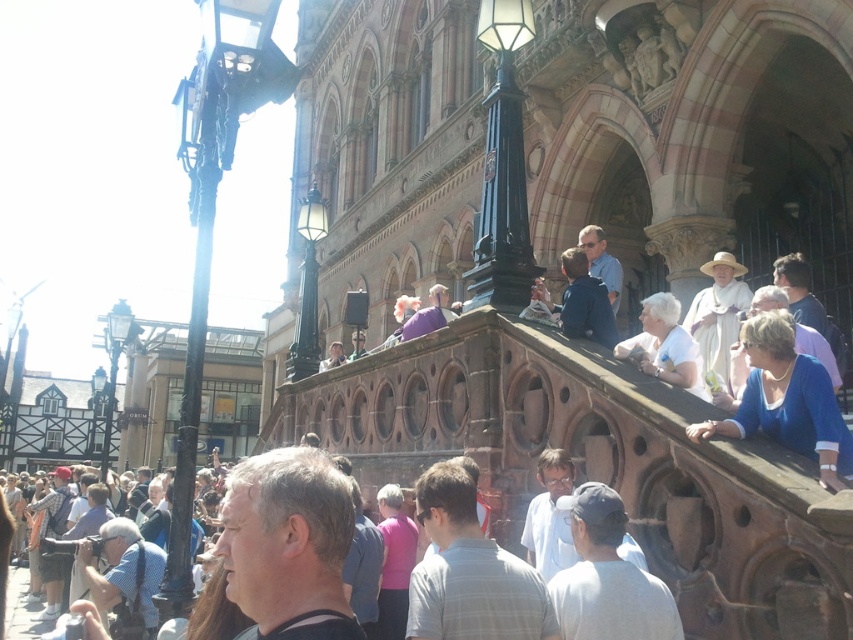
Question: Which of these objects is positioned closest to the dark blue shirt at upper center?

Choices:
 (A) plaid shirt at center
 (B) blue fabric at upper right
 (C) pink fabric shirt at center

Answer: (A)

Question: Can you confirm if plaid shirt at center is positioned above dark blue shirt at upper center?

Choices:
 (A) yes
 (B) no

Answer: (B)

Question: Which point is closer to the camera taking this photo?

Choices:
 (A) (700, 358)
 (B) (576, 248)
 (C) (428, 561)

Answer: (C)

Question: Is blue fabric at upper right below gray cotton shirt at center?

Choices:
 (A) no
 (B) yes

Answer: (A)

Question: Observing the image, what is the correct spatial positioning of gray cotton shirt at center in reference to pink fabric shirt at center?

Choices:
 (A) right
 (B) left

Answer: (A)

Question: Which object appears closest to the camera in this image?

Choices:
 (A) white matte shirt at upper right
 (B) blue fabric at upper right

Answer: (B)